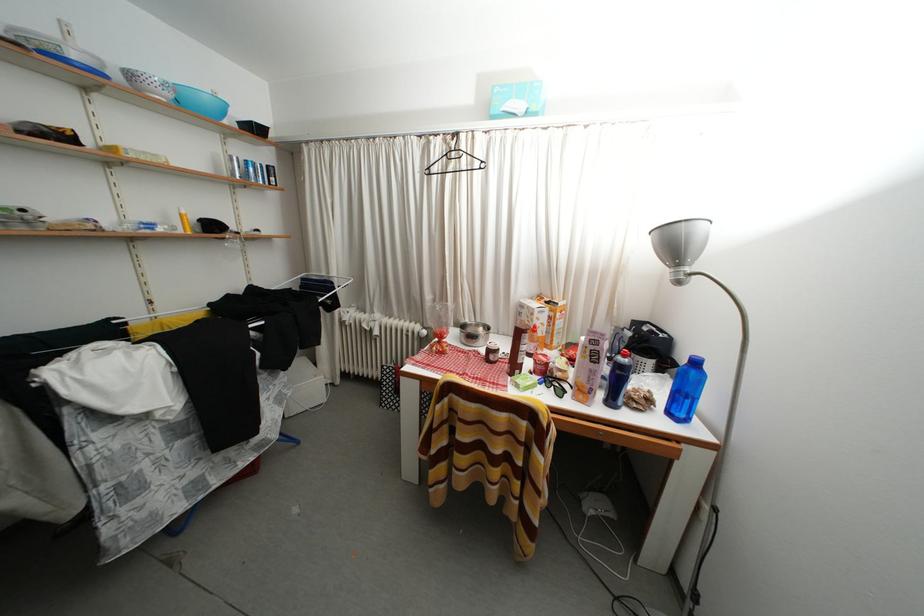
Where is `black clothes hanger`? black clothes hanger is located at coordinates (455, 161).